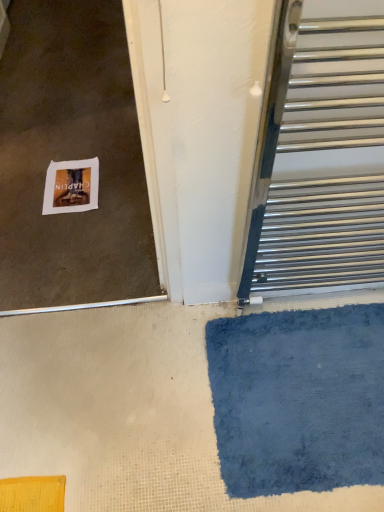
At what (x,y) coordinates should I click in order to perform the action: click on vacant space in blue plush bath mat at lower right (from a real-world perspective). Please return your answer as a coordinate pair (x, y). The height and width of the screenshot is (512, 384). Looking at the image, I should click on (303, 388).